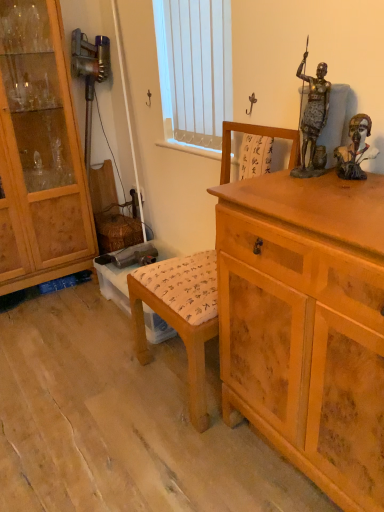
This screenshot has height=512, width=384. In order to click on bronze statue at upper right, the second person viewed from the right in this screenshot , I will do `click(313, 109)`.

What do you see at coordinates (313, 109) in the screenshot? This screenshot has height=512, width=384. I see `bronze statue at upper right, which is the first person from left to right` at bounding box center [313, 109].

Where is `wooden chair at center`? This screenshot has height=512, width=384. wooden chair at center is located at coordinates (180, 316).

You are a GUI agent. You are given a task and a screenshot of the screen. Output one action in this format:
    pyautogui.click(x=<x>, y=<y>)
    Task: Click on the white vertical blinds at upper center
    The width and height of the screenshot is (384, 512).
    Given the screenshot: What is the action you would take?
    pyautogui.click(x=194, y=71)

Where is `brown wooden bust at upper right, the first person when ordered from right to left`? The height and width of the screenshot is (512, 384). brown wooden bust at upper right, the first person when ordered from right to left is located at coordinates (355, 149).

Identify the location of bronze statue at upper right, the second person viewed from the right. (313, 109).

Is light brown wood cabinet at left not close to light brown wooden chest of drawers at right?

Yes, light brown wood cabinet at left and light brown wooden chest of drawers at right are located far from each other.

Between light brown wood cabinet at left and light brown wooden chest of drawers at right, which one has larger size?

light brown wood cabinet at left.

Is light brown wood cabinet at left outside of light brown wooden chest of drawers at right?

light brown wood cabinet at left lies outside light brown wooden chest of drawers at right's area.

Which object is further away from the camera, light brown wood cabinet at left or light brown wooden chest of drawers at right?

Positioned behind is light brown wood cabinet at left.

The height and width of the screenshot is (512, 384). Identify the location of the 1st person below the light brown wood cabinet at left (from the image's perspective). (313, 109).

Is light brown wood cabinet at left bigger or smaller than bronze statue at upper right, which is the first person from left to right?

Considering their sizes, light brown wood cabinet at left takes up more space than bronze statue at upper right, which is the first person from left to right.

Which object is positioned more to the left, light brown wood cabinet at left or bronze statue at upper right, which is the first person from left to right?

light brown wood cabinet at left is more to the left.

Is light brown wood cabinet at left completely or partially outside of bronze statue at upper right, the second person viewed from the right?

That's correct, light brown wood cabinet at left is outside of bronze statue at upper right, the second person viewed from the right.

Does light brown wooden chest of drawers at right lie in front of light brown wood cabinet at left?

That is True.

Which point is more distant from viewer, [259,362] or [32,88]?

The point [32,88] is behind.

Which is more to the right, light brown wooden chest of drawers at right or light brown wood cabinet at left?

light brown wooden chest of drawers at right is more to the right.

Is light brown wooden chest of drawers at right oriented towards light brown wood cabinet at left?

No, light brown wooden chest of drawers at right is not facing towards light brown wood cabinet at left.

Looking at the image, does white vertical blinds at upper center seem bigger or smaller compared to light brown wood cabinet at left?

Considering their sizes, white vertical blinds at upper center takes up less space than light brown wood cabinet at left.

Is white vertical blinds at upper center not inside light brown wood cabinet at left?

Yes, white vertical blinds at upper center is outside of light brown wood cabinet at left.

Would you consider white vertical blinds at upper center to be distant from light brown wood cabinet at left?

No.

Considering the sizes of objects white vertical blinds at upper center and light brown wood cabinet at left in the image provided, who is wider, white vertical blinds at upper center or light brown wood cabinet at left?

light brown wood cabinet at left is wider.

Does point (244, 410) come in front of point (306, 122)?

No.

In the image, is light brown wooden chest of drawers at right on the left side or the right side of bronze statue at upper right, the second person viewed from the right?

light brown wooden chest of drawers at right is to the right of bronze statue at upper right, the second person viewed from the right.

Is light brown wooden chest of drawers at right aimed at bronze statue at upper right, the second person viewed from the right?

No, light brown wooden chest of drawers at right does not turn towards bronze statue at upper right, the second person viewed from the right.

I want to click on window screen that is behind the wooden chair at center, so click(194, 71).

Is wooden chair at center aimed at white vertical blinds at upper center?

No, wooden chair at center does not turn towards white vertical blinds at upper center.

Which is in front, point (278, 130) or point (216, 54)?

The point (278, 130) is closer to the camera.

Is the position of brown wooden bust at upper right, the first person when ordered from right to left, less distant than that of white vertical blinds at upper center?

Yes, brown wooden bust at upper right, the first person when ordered from right to left, is closer to the camera.

Does brown wooden bust at upper right, the first person when ordered from right to left, appear on the right side of white vertical blinds at upper center?

Yes, brown wooden bust at upper right, the first person when ordered from right to left, is to the right of white vertical blinds at upper center.

Does point (364, 143) come behind point (177, 100)?

No, (364, 143) is in front of (177, 100).

The image size is (384, 512). What are the coordinates of `the chest of drawers located in front of the light brown wood cabinet at left` in the screenshot? It's located at (307, 324).

Identify the location of cabinetry below the bronze statue at upper right, which is the first person from left to right (from a real-world perspective). (39, 152).

Considering their positions, is brown wooden bust at upper right, marked as the 2th person in a left-to-right arrangement, positioned further to wooden chair at center than light brown wooden chest of drawers at right?

Based on the image, brown wooden bust at upper right, marked as the 2th person in a left-to-right arrangement, appears to be further to wooden chair at center.

From the image, which object appears to be nearer to wooden chair at center, light brown wooden chest of drawers at right or brown wooden bust at upper right, marked as the 2th person in a left-to-right arrangement?

Based on the image, light brown wooden chest of drawers at right appears to be nearer to wooden chair at center.

Estimate the real-world distances between objects in this image. Which object is closer to white vertical blinds at upper center, light brown wooden chest of drawers at right or wooden chair at center?

Among the two, wooden chair at center is located nearer to white vertical blinds at upper center.

Based on their spatial positions, is white vertical blinds at upper center or light brown wooden chest of drawers at right further from light brown wood cabinet at left?

light brown wooden chest of drawers at right lies further to light brown wood cabinet at left than the other object.

Considering their positions, is wooden chair at center positioned further to light brown wooden chest of drawers at right than light brown wood cabinet at left?

Based on the image, light brown wood cabinet at left appears to be further to light brown wooden chest of drawers at right.

Estimate the real-world distances between objects in this image. Which object is closer to white vertical blinds at upper center, light brown wood cabinet at left or wooden chair at center?

light brown wood cabinet at left lies closer to white vertical blinds at upper center than the other object.

Based on their spatial positions, is brown wooden bust at upper right, the first person when ordered from right to left, or bronze statue at upper right, the second person viewed from the right, further from wooden chair at center?

brown wooden bust at upper right, the first person when ordered from right to left, is further to wooden chair at center.

When comparing their distances from light brown wooden chest of drawers at right, does brown wooden bust at upper right, marked as the 2th person in a left-to-right arrangement, or white vertical blinds at upper center seem further?

white vertical blinds at upper center lies further to light brown wooden chest of drawers at right than the other object.

At what (x,y) coordinates should I click in order to perform the action: click on rocking chair between white vertical blinds at upper center and light brown wooden chest of drawers at right in the vertical direction. Please return your answer as a coordinate pair (x, y). The image size is (384, 512). Looking at the image, I should click on (180, 316).

Find the location of a particular element. This screenshot has height=512, width=384. rocking chair between brown wooden bust at upper right, marked as the 2th person in a left-to-right arrangement, and light brown wooden chest of drawers at right vertically is located at coordinates (180, 316).

Find the location of a particular element. This screenshot has height=512, width=384. rocking chair between light brown wood cabinet at left and light brown wooden chest of drawers at right is located at coordinates (180, 316).

Find the location of a particular element. This screenshot has height=512, width=384. rocking chair between bronze statue at upper right, which is the first person from left to right, and light brown wooden chest of drawers at right, in the vertical direction is located at coordinates (180, 316).